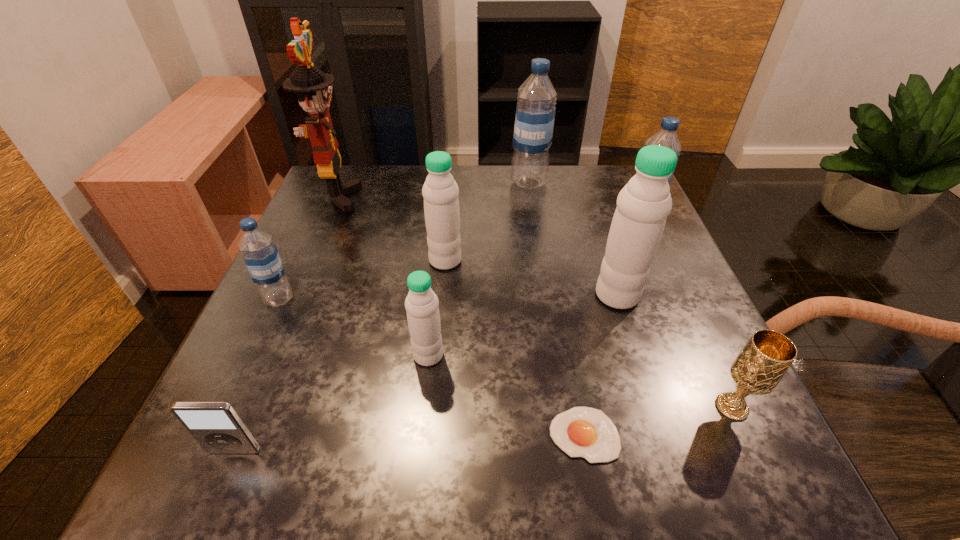
The width and height of the screenshot is (960, 540). Find the location of `the smallest white water bottle`. the smallest white water bottle is located at coordinates (423, 317).

This screenshot has width=960, height=540. I want to click on the smallest blue water bottle, so click(260, 254).

This screenshot has width=960, height=540. I want to click on the leftmost water bottle, so [x=260, y=254].

Locate an element on the screen. Image resolution: width=960 pixels, height=540 pixels. the eighth tallest object is located at coordinates (759, 367).

This screenshot has height=540, width=960. I want to click on the second shortest object, so click(x=216, y=426).

Identify the location of egg yolk. The width and height of the screenshot is (960, 540). (586, 432).

Locate an element on the screen. free point located 0.090m on the front-facing side of the tallest object is located at coordinates (395, 197).

Locate an element on the screen. The image size is (960, 540). vacant space located 0.160m on the label of the farthest blue water bottle is located at coordinates (449, 183).

Locate an element on the screen. The height and width of the screenshot is (540, 960). free space located 0.230m on the label of the farthest blue water bottle is located at coordinates (421, 183).

Where is `vacant area situated 0.400m on the label of the farthest blue water bottle`? Image resolution: width=960 pixels, height=540 pixels. vacant area situated 0.400m on the label of the farthest blue water bottle is located at coordinates (356, 183).